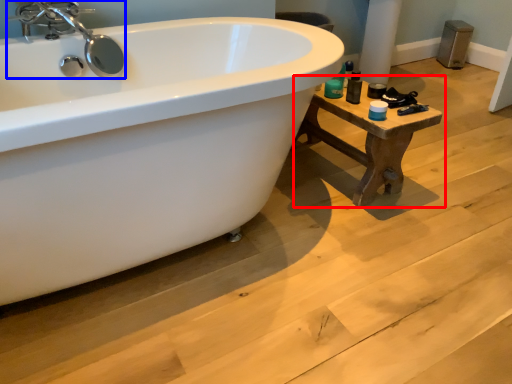
Question: Which point is further to the camera, table (highlighted by a red box) or tap (highlighted by a blue box)?

Choices:
 (A) table
 (B) tap

Answer: (A)